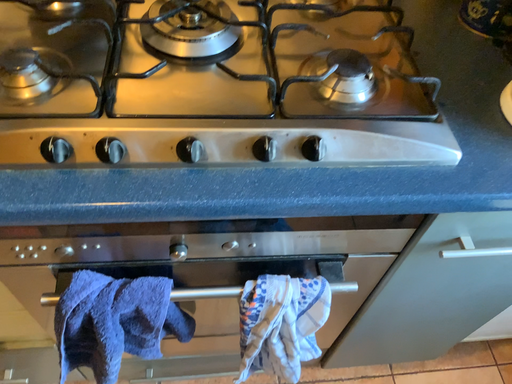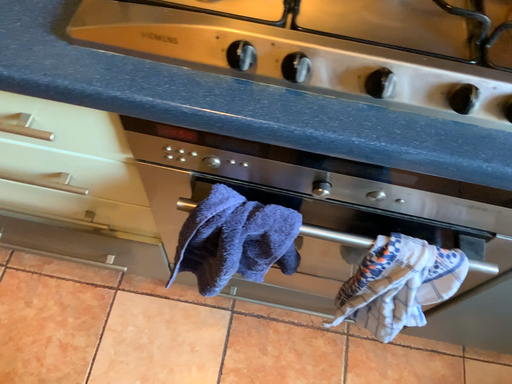
Question: Which way did the camera rotate in the video?

Choices:
 (A) rotated upward
 (B) rotated downward

Answer: (B)